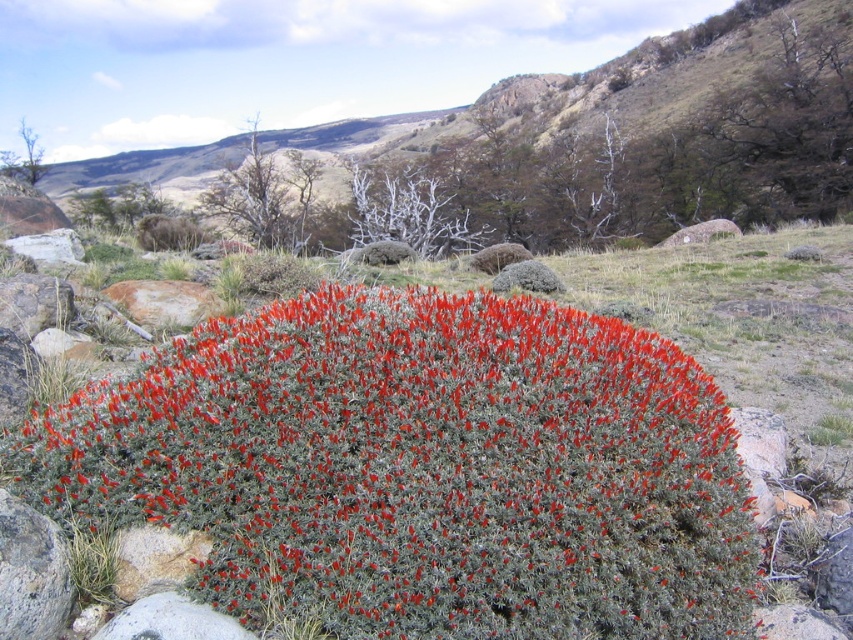
Which of these two, red fuzzy bush at center or green grassy hillside at center, stands shorter?

With less height is red fuzzy bush at center.

In the scene shown: Can you confirm if red fuzzy bush at center is positioned to the right of green grassy hillside at center?

Correct, you'll find red fuzzy bush at center to the right of green grassy hillside at center.

Which is in front, point (328, 397) or point (505, 202)?

Point (328, 397) is more forward.

The image size is (853, 640). I want to click on red fuzzy bush at center, so click(x=421, y=468).